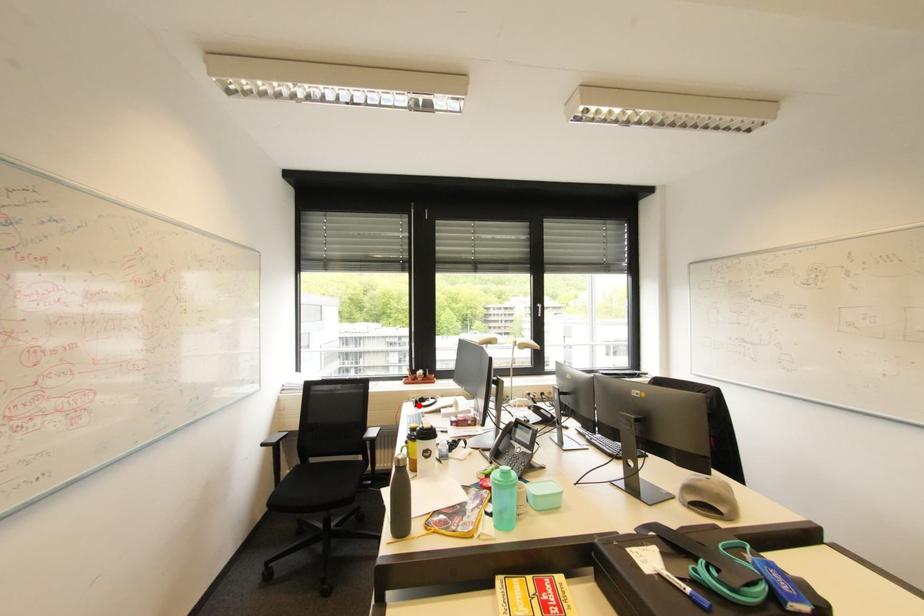
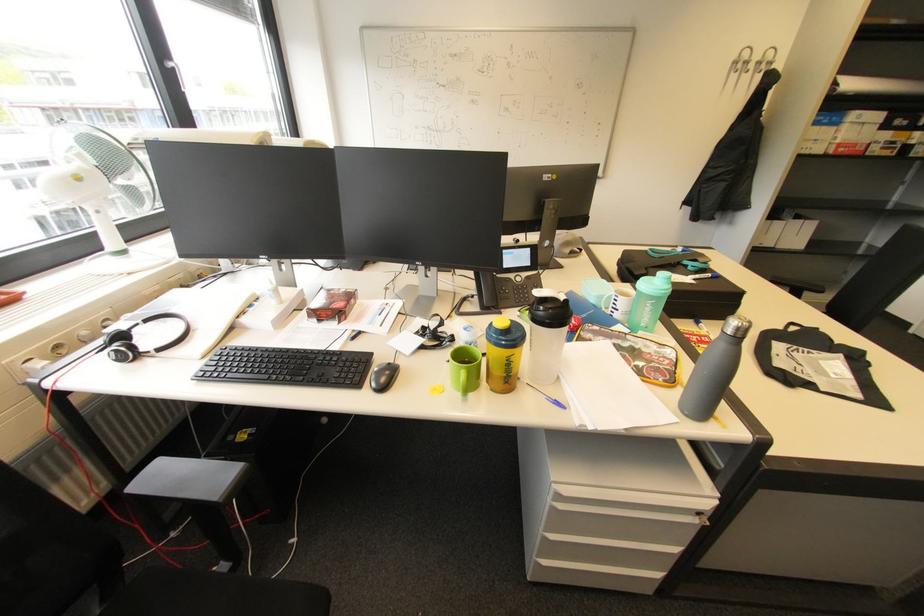
Where in the second image is the point corresponding to the highlighted location from the first image?

(127, 361)